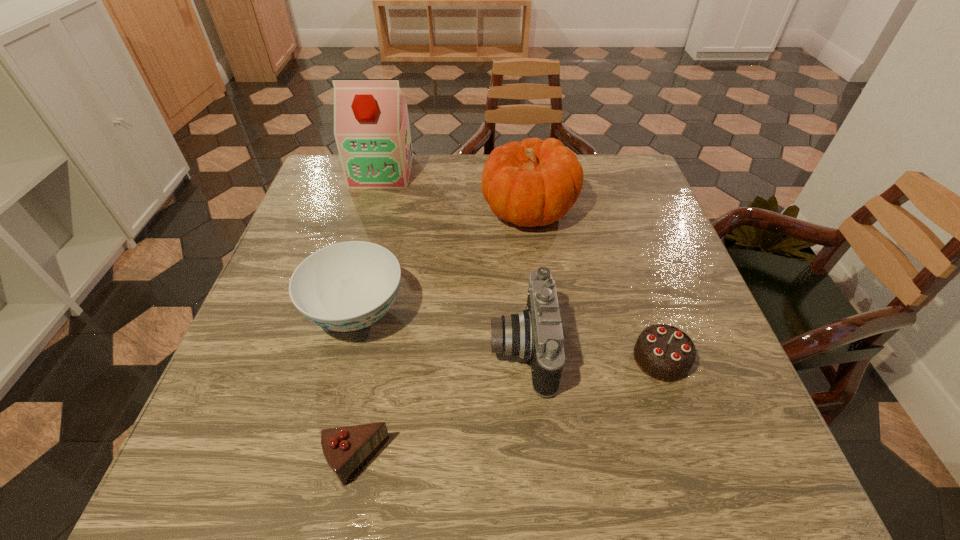
This screenshot has width=960, height=540. What are the coordinates of `free point between the left chocolate cake and the farther chocolate cake` in the screenshot? It's located at (509, 410).

This screenshot has height=540, width=960. What are the coordinates of `free space between the fourth shortest object and the soya milk` in the screenshot? It's located at (452, 260).

At what (x,y) coordinates should I click in order to perform the action: click on unoccupied position between the left chocolate cake and the pumpkin. Please return your answer as a coordinate pair (x, y). This screenshot has height=540, width=960. Looking at the image, I should click on (443, 335).

Image resolution: width=960 pixels, height=540 pixels. I want to click on vacant area between the soya milk and the camera, so click(452, 260).

Image resolution: width=960 pixels, height=540 pixels. What are the coordinates of `vacant area that lies between the nearer chocolate cake and the third tallest object` in the screenshot? It's located at (439, 404).

Locate an element on the screen. This screenshot has height=540, width=960. free space that is in between the third shortest object and the pumpkin is located at coordinates (443, 261).

Locate an element on the screen. vacant space that is in between the pumpkin and the camera is located at coordinates (x=525, y=279).

Identify the location of object that is the fifth closest to the rightmost object. (371, 126).

This screenshot has height=540, width=960. What are the coordinates of `object that is the second closest to the pumpkin` in the screenshot? It's located at (536, 333).

In order to click on vacant space that satisfies the following two spatial constraints: 1. with the cap open on the left chocolate cake; 2. on the left side of the tallest object in this screenshot , I will do `click(301, 461)`.